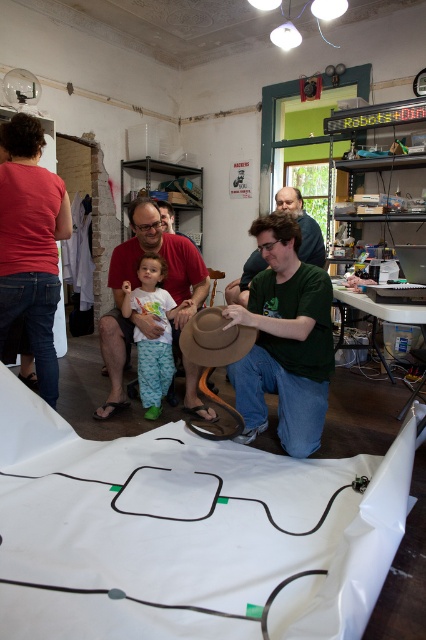
Is brown felt cowboy hat at center to the left of green matte shirt at center from the viewer's perspective?

Correct, you'll find brown felt cowboy hat at center to the left of green matte shirt at center.

Who is more distant from viewer, (x=215, y=360) or (x=256, y=260)?

The point (x=256, y=260) is more distant.

Locate an element on the screen. The width and height of the screenshot is (426, 640). brown felt cowboy hat at center is located at coordinates (215, 339).

Can you confirm if green matte hat at center is smaller than brown felt cowboy hat at center?

Incorrect, green matte hat at center is not smaller in size than brown felt cowboy hat at center.

Can you confirm if green matte hat at center is bigger than brown felt cowboy hat at center?

Yes, green matte hat at center is bigger than brown felt cowboy hat at center.

Which is in front, point (302, 316) or point (216, 356)?

Positioned in front is point (216, 356).

At what (x,y) coordinates should I click in order to perform the action: click on green matte hat at center. Please return your answer as a coordinate pair (x, y). Looking at the image, I should click on (284, 340).

Does brown leather hat at center appear under white cotton shirt at center?

Incorrect, brown leather hat at center is not positioned below white cotton shirt at center.

Does point (143, 321) come farther from viewer compared to point (155, 294)?

No.

Where is `brown leather hat at center`? brown leather hat at center is located at coordinates (138, 285).